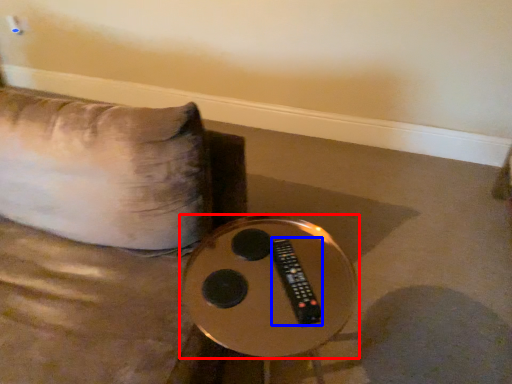
Question: Which point is further to the camera, table (highlighted by a red box) or remote (highlighted by a blue box)?

Choices:
 (A) table
 (B) remote

Answer: (B)